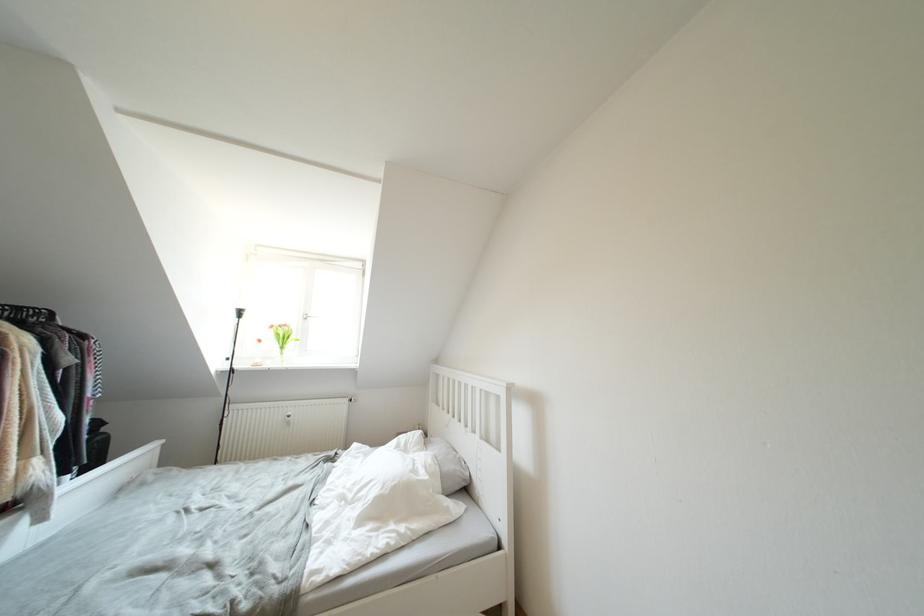
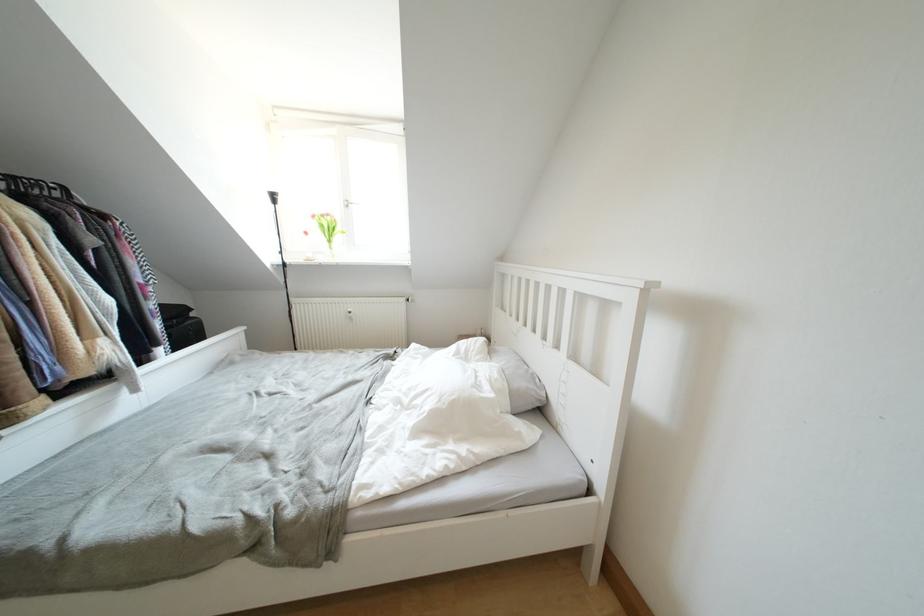
Question: The images are taken continuously from a first-person perspective. In which direction is your viewpoint rotating?

Choices:
 (A) Left
 (B) Right
 (C) Up
 (D) Down

Answer: (D)